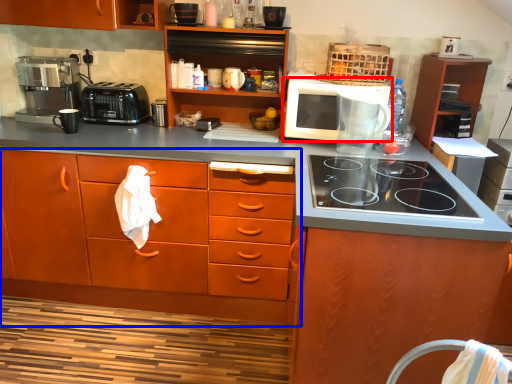
Question: Which of the following is the farthest to the observer, microwave oven (highlighted by a red box) or cabinetry (highlighted by a blue box)?

Choices:
 (A) microwave oven
 (B) cabinetry

Answer: (A)